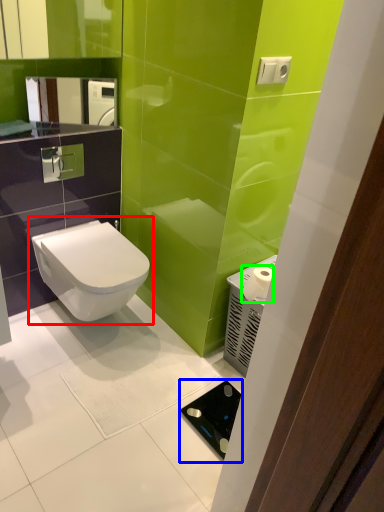
Question: Which object is the closest to the toilet (highlighted by a red box)? Choose among these: appliance (highlighted by a blue box) or toilet paper (highlighted by a green box).

Choices:
 (A) appliance
 (B) toilet paper

Answer: (B)